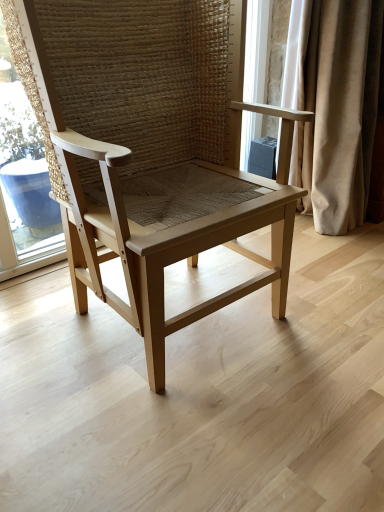
Locate an element on the screen. The width and height of the screenshot is (384, 512). free space in front of beige fabric curtain at right is located at coordinates (342, 255).